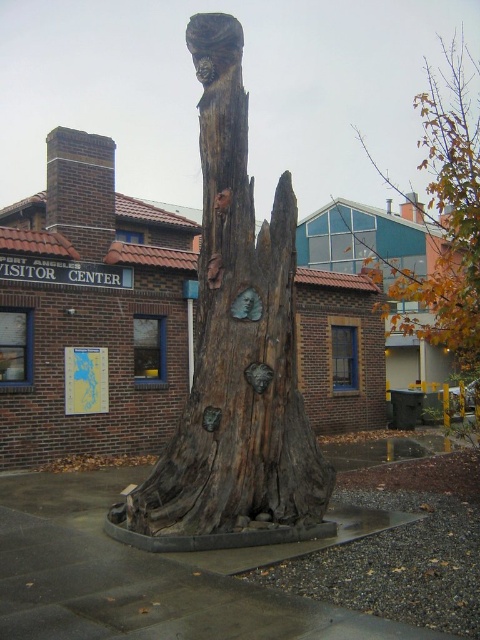
You are standing in front of the Port Angeles Visitor Center and notice two tree trunk sculptures. The weathered wood tree trunk at center and the brown wood tree trunk at upper right. Which sculpture is located above the other?

The brown wood tree trunk at upper right is positioned above the weathered wood tree trunk at center.

You are standing in front of the Port Angeles Visitor Center and want to take a photo of the sculpture located at point (276, 372). If your camera has a maximum focus range of 6 meters, will you be able to capture the sculpture clearly?

The distance between you and the sculpture at point (276, 372) is 6.19 meters, which exceeds the camera maximum focus range of 6 meters. Therefore, you won not be able to capture the sculpture clearly.